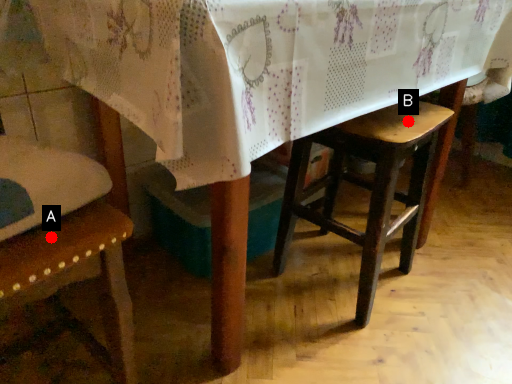
Question: Two points are circled on the image, labeled by A and B beside each circle. Which point is farther from the camera taking this photo?

Choices:
 (A) A is further
 (B) B is further

Answer: (B)